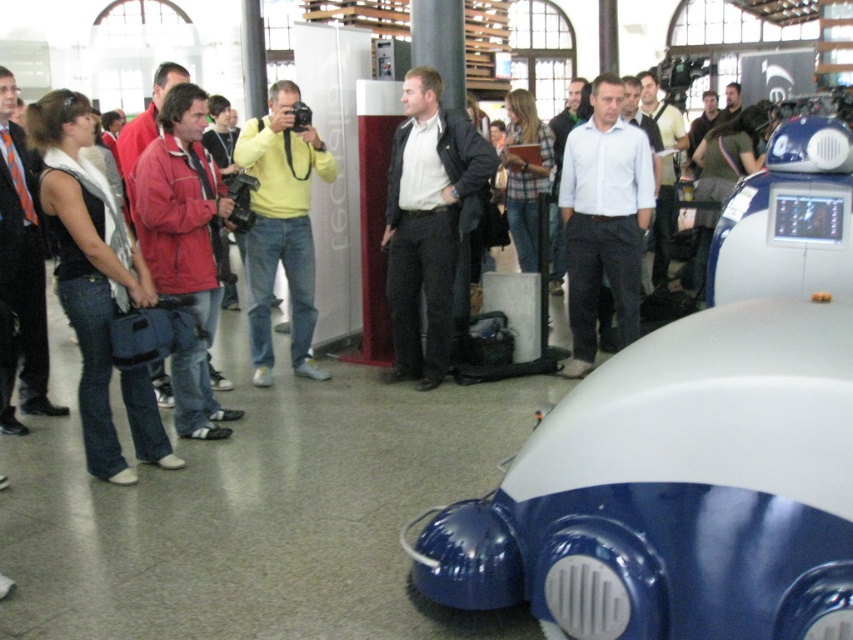
You are a photographer at the event and want to capture a photo of the robotic vehicle. You notice two people in the front row wearing shirts of different colors. The white shirt at center and the yellow matte shirt at center are both blocking your view. Which person should you ask to move so that you can see the robotic vehicle better, considering their shirt sizes?

Since the white shirt at center is narrower than the yellow matte shirt at center, you should ask the person wearing the yellow matte shirt at center to move first, as they take up more space and are more likely blocking your view of the robotic vehicle.

You are standing at the entrance of the venue and see the robotic vehicle in the foreground. Where is the matte black jacket at center located relative to the robotic vehicle?

The matte black jacket at center is located at the center of the image, which is directly in front of the robotic vehicle.

You are standing in the middle of the room and want to place a small decoration between the two points, point (573, 346) and point (282, 193). Which point should you move towards first to reach the closer one?

You should move towards point (282, 193) first because it is closer to you than point (573, 346), which is further away.